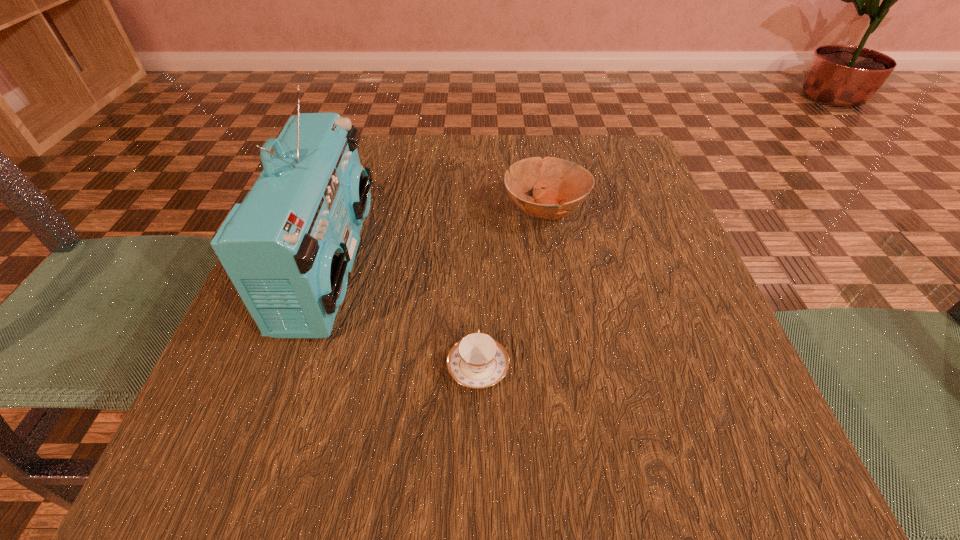
Locate which object is the second closest to the shortest object. Please provide its 2D coordinates. Your answer should be formatted as a tuple, i.e. [(x, y)], where the tuple contains the x and y coordinates of a point satisfying the conditions above.

[(567, 184)]

Choose which object is the nearest neighbor to the second shortest object. Please provide its 2D coordinates. Your answer should be formatted as a tuple, i.e. [(x, y)], where the tuple contains the x and y coordinates of a point satisfying the conditions above.

[(477, 361)]

Image resolution: width=960 pixels, height=540 pixels. What are the coordinates of `free space that satisfies the following two spatial constraints: 1. on the side with the handle of the shortest object; 2. on the left side of the bowl` in the screenshot? It's located at (478, 210).

Where is `free space that satisfies the following two spatial constraints: 1. on the front-facing side of the leftmost object; 2. on the side with the handle of the second object from right to left`? This screenshot has width=960, height=540. free space that satisfies the following two spatial constraints: 1. on the front-facing side of the leftmost object; 2. on the side with the handle of the second object from right to left is located at coordinates (296, 367).

Identify the location of free point that satisfies the following two spatial constraints: 1. on the side with the handle of the shortest object; 2. on the front-facing side of the radio receiver. (478, 265).

Where is `free spot that satisfies the following two spatial constraints: 1. on the side with the handle of the second object from left to right; 2. on the right side of the rightmost object`? This screenshot has width=960, height=540. free spot that satisfies the following two spatial constraints: 1. on the side with the handle of the second object from left to right; 2. on the right side of the rightmost object is located at coordinates (478, 210).

Where is `free space in the image that satisfies the following two spatial constraints: 1. on the side with the handle of the teacup; 2. on the front-facing side of the tallest object`? This screenshot has width=960, height=540. free space in the image that satisfies the following two spatial constraints: 1. on the side with the handle of the teacup; 2. on the front-facing side of the tallest object is located at coordinates (478, 265).

Find the location of a particular element. This screenshot has width=960, height=540. free region that satisfies the following two spatial constraints: 1. on the side with the handle of the second object from right to left; 2. on the left side of the rightmost object is located at coordinates (478, 210).

At what (x,y) coordinates should I click in order to perform the action: click on free space that satisfies the following two spatial constraints: 1. on the side with the handle of the shortest object; 2. on the right side of the second shortest object. Please return your answer as a coordinate pair (x, y). The width and height of the screenshot is (960, 540). Looking at the image, I should click on (478, 210).

Locate an element on the screen. free location that satisfies the following two spatial constraints: 1. on the side with the handle of the second shortest object; 2. on the left side of the shortest object is located at coordinates (478, 210).